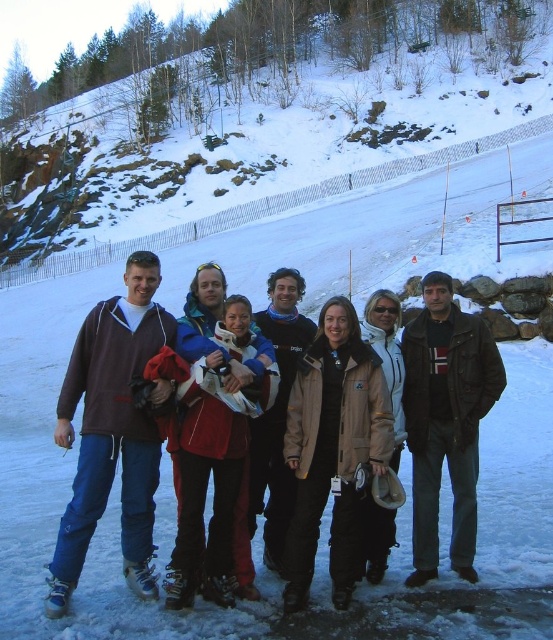
Which is below, dark brown leather jacket at center or blue fleece jacket at center?

dark brown leather jacket at center

Which is in front, point (476, 480) or point (279, 300)?

Point (476, 480) is more forward.

Describe the element at coordinates (446, 420) in the screenshot. I see `dark brown leather jacket at center` at that location.

Identify the location of dark brown leather jacket at center. (446, 420).

Is snowy rock at center to the left of dark brown leather jacket at center from the viewer's perspective?

Correct, you'll find snowy rock at center to the left of dark brown leather jacket at center.

What do you see at coordinates (263, 115) in the screenshot? I see `snowy rock at center` at bounding box center [263, 115].

Is point (542, 20) farther from viewer compared to point (418, 387)?

Yes, it is behind point (418, 387).

The height and width of the screenshot is (640, 553). What are the coordinates of `snowy rock at center` in the screenshot? It's located at (263, 115).

Which is more to the left, snowy rock at center or matte brown jacket at left?

matte brown jacket at left

Is snowy rock at center to the left of matte brown jacket at left from the viewer's perspective?

No, snowy rock at center is not to the left of matte brown jacket at left.

Who is more forward, (468, 60) or (70, 561)?

Positioned in front is point (70, 561).

You are a GUI agent. You are given a task and a screenshot of the screen. Output one action in this format:
    pyautogui.click(x=<x>, y=<y>)
    Task: Click on the snowy rock at center
    
    Given the screenshot: What is the action you would take?
    pyautogui.click(x=263, y=115)